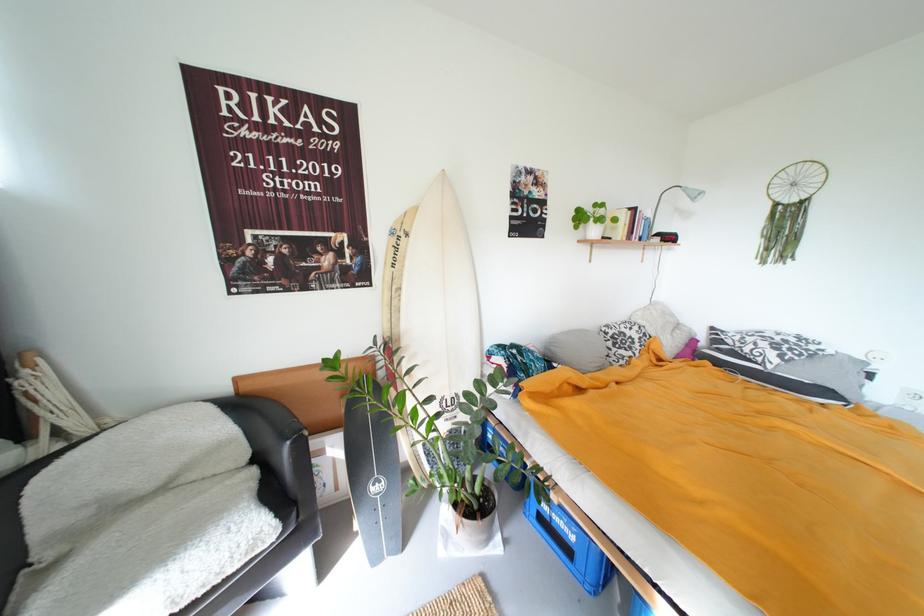
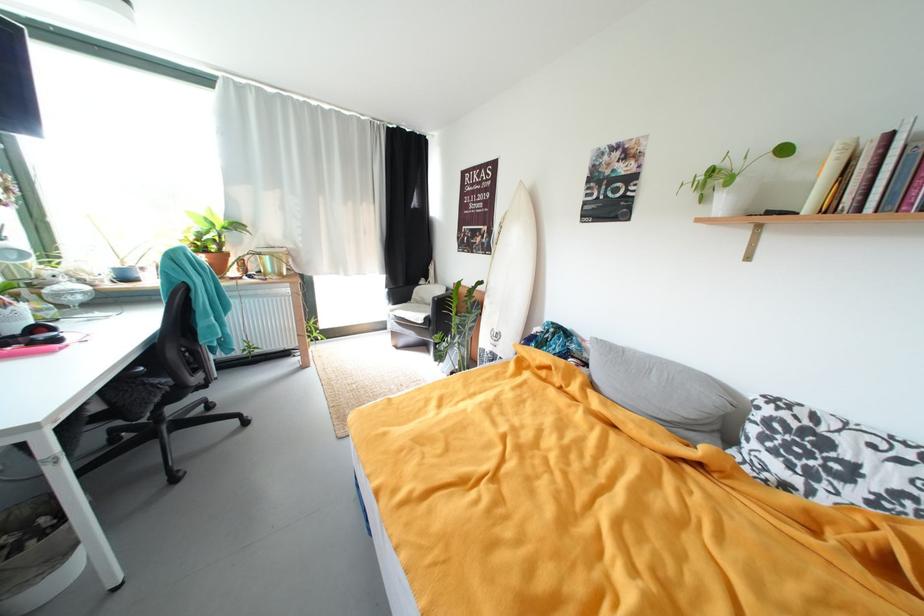
The point at (369,249) is marked in the first image. Where is the corresponding point in the second image?

(497, 235)